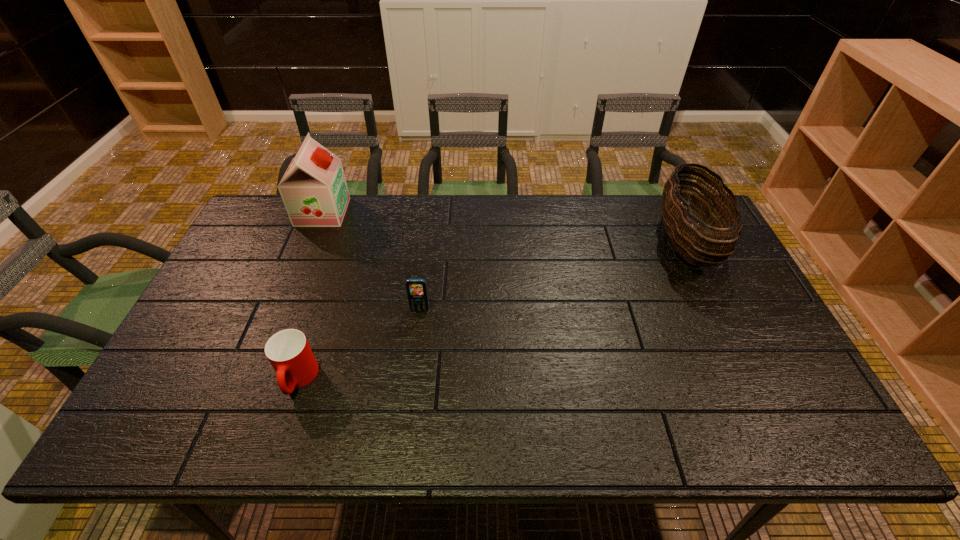
At what (x,y) coordinates should I click in order to perform the action: click on soya milk. Please return your answer as a coordinate pair (x, y). The image size is (960, 540). Looking at the image, I should click on 314,191.

The image size is (960, 540). In order to click on the third shortest object in this screenshot , I will do `click(684, 235)`.

Where is `basket`? This screenshot has height=540, width=960. basket is located at coordinates (684, 235).

Where is `cellular telephone`? This screenshot has width=960, height=540. cellular telephone is located at coordinates (417, 293).

Locate an element on the screen. The width and height of the screenshot is (960, 540). the third object from left to right is located at coordinates (417, 293).

Locate an element on the screen. cup is located at coordinates (288, 351).

At what (x,y) coordinates should I click in order to perform the action: click on free space located 0.390m with the cap open on the tallest object. Please return your answer as a coordinate pair (x, y). The width and height of the screenshot is (960, 540). Looking at the image, I should click on (458, 212).

In order to click on free space located on the left of the basket in this screenshot , I will do (x=543, y=241).

Locate an element on the screen. The image size is (960, 540). blank space located 0.060m on the screen of the cellular telephone is located at coordinates (418, 330).

Identify the location of free space located 0.080m on the side of the cup with the handle. (279, 436).